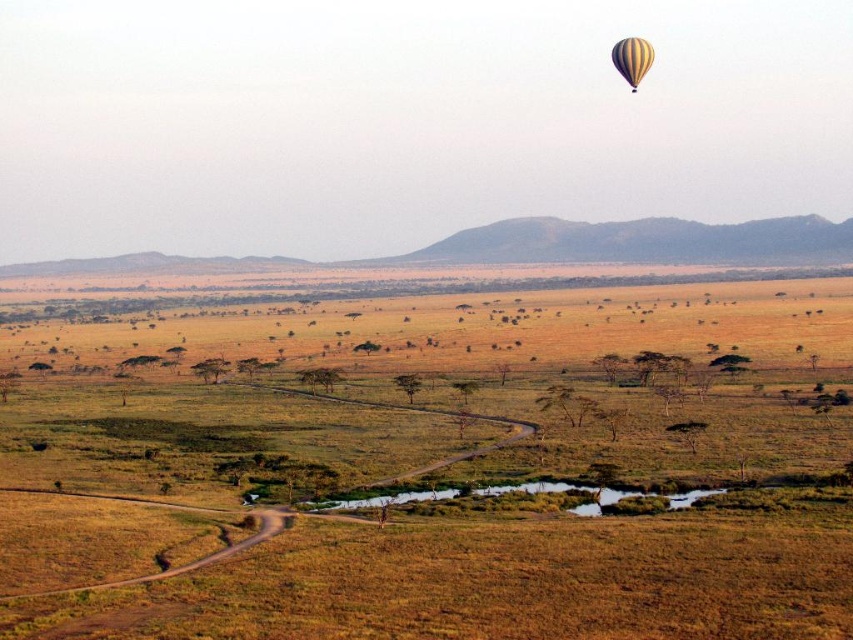
Does point (9, 492) come closer to viewer compared to point (634, 72)?

Yes, point (9, 492) is closer to viewer.

Which of these two, brown grassland at center or yellow striped balloon at upper right, stands taller?

brown grassland at center is taller.

Who is more distant from viewer, (668, 417) or (643, 44)?

The point (668, 417) is behind.

Locate an element on the screen. brown grassland at center is located at coordinates (393, 412).